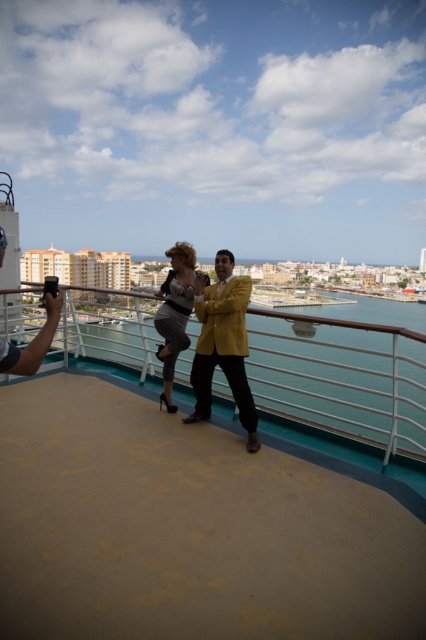
Question: In this image, where is blue glossy water at center located relative to shiny yellow blazer at center?

Choices:
 (A) below
 (B) above

Answer: (A)

Question: Which of the following is the closest to the observer?

Choices:
 (A) smooth tan deck at center
 (B) blue glossy water at center

Answer: (A)

Question: Does smooth tan deck at center have a lesser width compared to blue glossy water at center?

Choices:
 (A) yes
 (B) no

Answer: (A)

Question: Which object appears farthest from the camera in this image?

Choices:
 (A) shiny yellow blazer at center
 (B) blue glossy water at center
 (C) shiny silver dress at center

Answer: (C)

Question: Does smooth tan deck at center have a smaller size compared to shiny silver dress at center?

Choices:
 (A) no
 (B) yes

Answer: (B)

Question: Estimate the real-world distances between objects in this image. Which object is farther from the shiny silver dress at center?

Choices:
 (A) shiny yellow blazer at center
 (B) blue glossy water at center
 (C) smooth tan deck at center

Answer: (B)